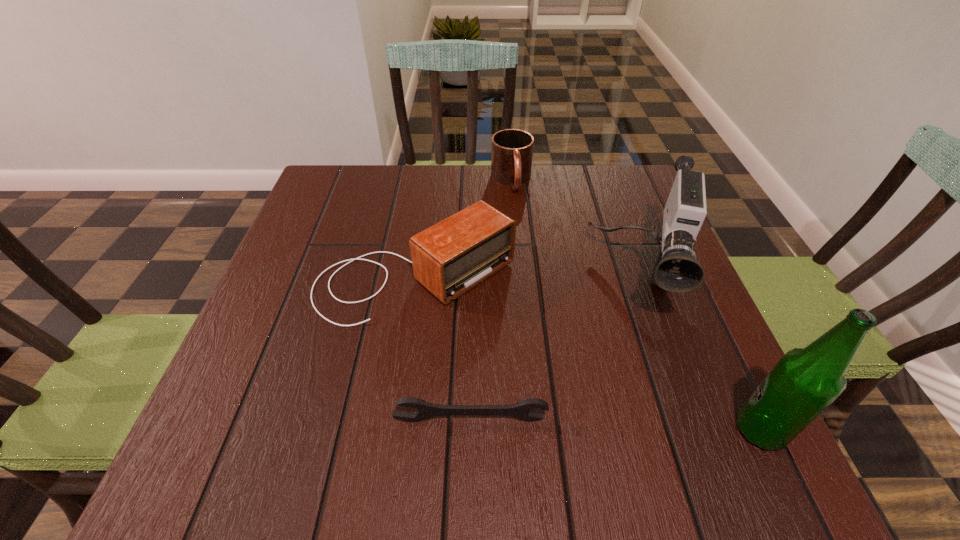
Find the location of `vacant space on the desktop that is between the wrench and the tallest object and is positioned on the recording direction of the camcorder`. vacant space on the desktop that is between the wrench and the tallest object and is positioned on the recording direction of the camcorder is located at coordinates (626, 425).

Find the location of `vacant space on the desktop that is between the wrench and the tallest object and is positioned on the side of the farthest object with the handle`. vacant space on the desktop that is between the wrench and the tallest object and is positioned on the side of the farthest object with the handle is located at coordinates (574, 423).

Image resolution: width=960 pixels, height=540 pixels. What are the coordinates of `vacant space on the desktop that is between the wrench and the tallest object and is positioned on the front-facing side of the radio receiver` in the screenshot? It's located at (577, 423).